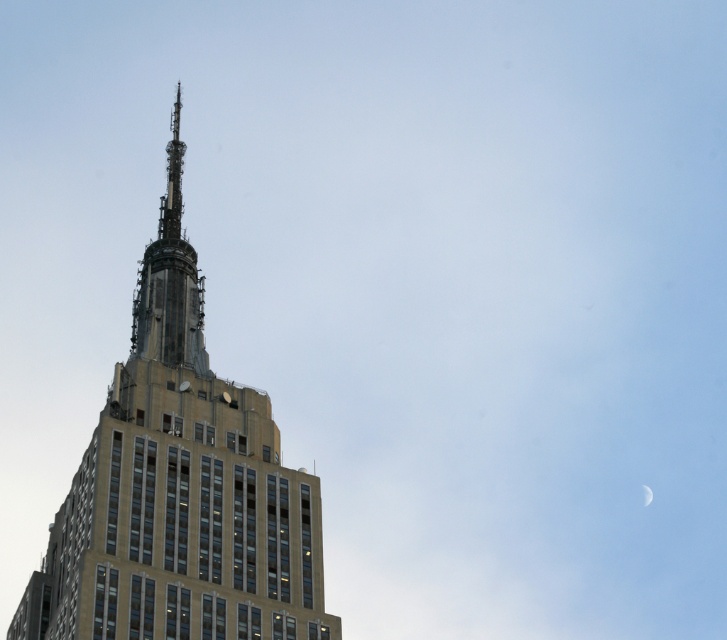
Question: Which object is the closest to the silvery metallic crescent at upper right?

Choices:
 (A) beige stone tower at center
 (B) dark gray metallic spire at center

Answer: (B)

Question: Considering the relative positions of dark gray metallic spire at center and silvery metallic crescent at upper right in the image provided, where is dark gray metallic spire at center located with respect to silvery metallic crescent at upper right?

Choices:
 (A) left
 (B) right

Answer: (A)

Question: Which point is farther to the camera?

Choices:
 (A) silvery metallic crescent at upper right
 (B) beige stone tower at center

Answer: (A)

Question: Can you confirm if dark gray metallic spire at center is thinner than silvery metallic crescent at upper right?

Choices:
 (A) no
 (B) yes

Answer: (A)

Question: Which point appears farthest from the camera in this image?

Choices:
 (A) (134, 301)
 (B) (642, 486)
 (C) (208, 404)

Answer: (B)

Question: Can you confirm if beige stone tower at center is positioned above silvery metallic crescent at upper right?

Choices:
 (A) yes
 (B) no

Answer: (A)